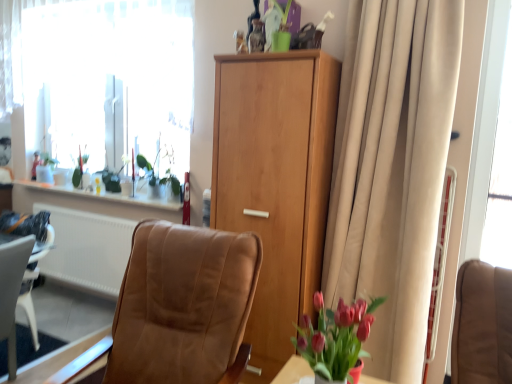
Question: Can you confirm if green matte plant at upper left, which is the second plant in left-to-right order, is taller than transparent glass window screen at right?

Choices:
 (A) yes
 (B) no

Answer: (B)

Question: From a real-world perspective, does green matte plant at upper left, which is the 1th plant from front to back, sit lower than transparent glass window screen at right?

Choices:
 (A) no
 (B) yes

Answer: (B)

Question: Could transparent glass window screen at right be considered to be inside green matte plant at upper left, which is the second plant in left-to-right order?

Choices:
 (A) yes
 (B) no

Answer: (B)

Question: Is green matte plant at upper left, which is the second plant in left-to-right order, outside transparent glass window screen at right?

Choices:
 (A) no
 (B) yes

Answer: (B)

Question: Considering the relative sizes of green matte plant at upper left, which is the 1th plant from front to back, and transparent glass window screen at right in the image provided, is green matte plant at upper left, which is the 1th plant from front to back, bigger than transparent glass window screen at right?

Choices:
 (A) no
 (B) yes

Answer: (A)

Question: From the image's perspective, is green matte plant at upper left, which is the second plant in left-to-right order, located beneath transparent glass window screen at right?

Choices:
 (A) no
 (B) yes

Answer: (B)

Question: From the image's perspective, is green glossy vase at upper left, the 1th plant when ordered from left to right, on top of white sheer curtain at upper left?

Choices:
 (A) yes
 (B) no

Answer: (B)

Question: Does green glossy vase at upper left, which appears as the second plant when viewed from the front, have a lesser width compared to white sheer curtain at upper left?

Choices:
 (A) no
 (B) yes

Answer: (B)

Question: From a real-world perspective, is green glossy vase at upper left, marked as the second plant in a right-to-left arrangement, beneath white sheer curtain at upper left?

Choices:
 (A) yes
 (B) no

Answer: (A)

Question: Does green glossy vase at upper left, marked as the second plant in a right-to-left arrangement, appear on the right side of white sheer curtain at upper left?

Choices:
 (A) yes
 (B) no

Answer: (B)

Question: Can you confirm if green glossy vase at upper left, which is the first plant in back-to-front order, is smaller than white sheer curtain at upper left?

Choices:
 (A) no
 (B) yes

Answer: (B)

Question: Considering the relative sizes of green glossy vase at upper left, which is the first plant in back-to-front order, and white sheer curtain at upper left in the image provided, is green glossy vase at upper left, which is the first plant in back-to-front order, wider than white sheer curtain at upper left?

Choices:
 (A) yes
 (B) no

Answer: (B)

Question: Is light brown wood cabinet at center positioned with its back to leather-like brown chair at center?

Choices:
 (A) yes
 (B) no

Answer: (B)